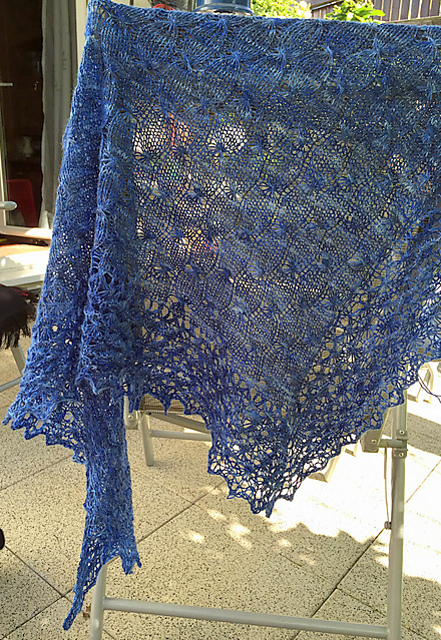
The width and height of the screenshot is (441, 640). Find the location of `tile`. tile is located at coordinates (40, 502).